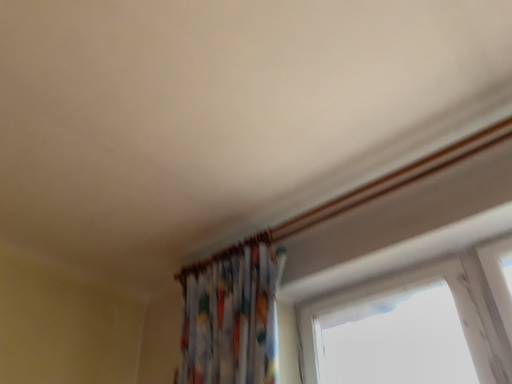
The height and width of the screenshot is (384, 512). Describe the element at coordinates (412, 308) in the screenshot. I see `transparent glass window at upper right` at that location.

Where is `transparent glass window at upper right`? The height and width of the screenshot is (384, 512). transparent glass window at upper right is located at coordinates (412, 308).

What is the approximate height of transparent glass window at upper right?

1.46 inches.

The image size is (512, 384). I want to click on transparent glass window at upper right, so click(x=412, y=308).